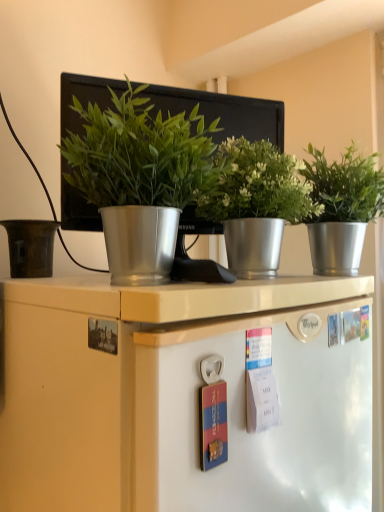
Question: Looking at the image, does matte brown pot at left seem bigger or smaller compared to metallic silver pot at center, the 2th houseplant viewed from the left?

Choices:
 (A) small
 (B) big

Answer: (A)

Question: From a real-world perspective, is matte brown pot at left positioned above or below metallic silver pot at center, which is counted as the second houseplant, starting from the right?

Choices:
 (A) below
 (B) above

Answer: (A)

Question: Estimate the real-world distances between objects in this image. Which object is closer to the matte brown pot at left?

Choices:
 (A) silver metallic pot at right, which is counted as the 1th houseplant, starting from the right
 (B) green metallic plant pot at center, which is the third houseplant in right-to-left order
 (C) metallic silver pot at center, the 2th houseplant viewed from the left

Answer: (B)

Question: Considering the real-world distances, which object is closest to the metallic silver pot at center, the 2th houseplant viewed from the left?

Choices:
 (A) matte brown pot at left
 (B) silver metallic pot at right, which is the 3th houseplant in left-to-right order
 (C) green metallic plant pot at center, the first houseplant positioned from the left

Answer: (B)